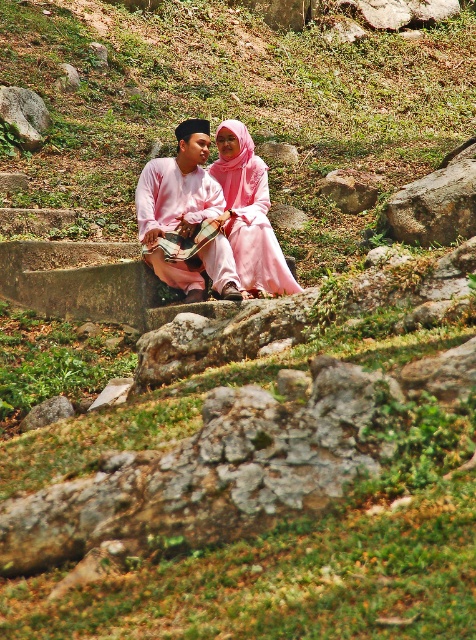
You are standing in front of the stone bench where the two people are sitting. You want to place a small flag at the point closer to you between point (265,236) and point (26,116). Which point should you choose?

You should choose point (265,236) because it is closer to the viewer than point (26,116).

You are a photographer planning to take a portrait of the two people sitting on the stone bench. You want to ensure the pink satin dress at center and the gray rough rock at upper left are both visible in the frame. Based on their positions, which object is closer to the left side of the photo?

The gray rough rock at upper left is closer to the left side of the photo because the pink satin dress at center is to the right of it.

You are a photographer trying to capture a closeup of the smooth gray rock at center. However, the matte pink clothing at center is blocking your view. Can you adjust your angle to see the rock without moving the clothing?

The matte pink clothing at center is below the smooth gray rock at center, so you can adjust your angle by looking upwards to see the rock without moving the clothing.